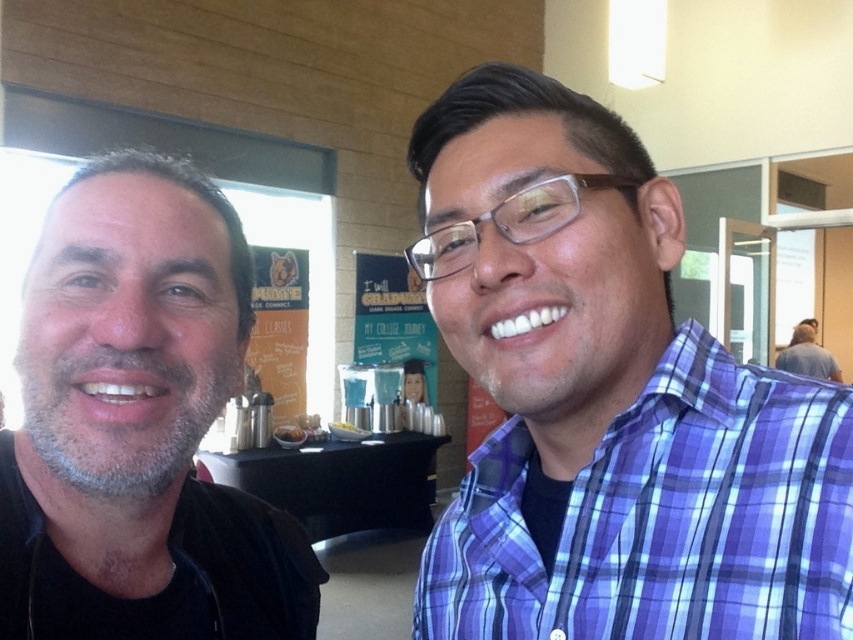
Question: Is black matte shirt at left above black glossy table at center?

Choices:
 (A) no
 (B) yes

Answer: (B)

Question: Which of the following is the farthest from the observer?

Choices:
 (A) (815, 369)
 (B) (608, 426)
 (C) (404, 483)

Answer: (A)

Question: Which of the following is the farthest from the observer?

Choices:
 (A) black matte shirt at left
 (B) black glossy table at center
 (C) gray hair at upper right
 (D) purple plaid shirt at right

Answer: (C)

Question: Is purple plaid shirt at right in front of gray hair at upper right?

Choices:
 (A) yes
 (B) no

Answer: (A)

Question: Is black glossy table at center above gray hair at upper right?

Choices:
 (A) yes
 (B) no

Answer: (B)

Question: Which of these objects is positioned farthest from the black matte shirt at left?

Choices:
 (A) black glossy table at center
 (B) purple plaid shirt at right

Answer: (A)